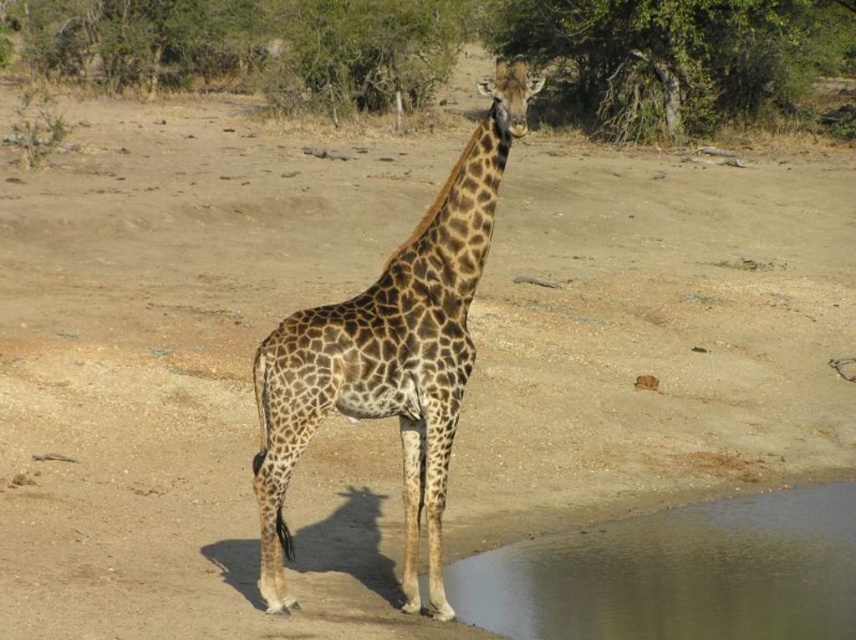
Question: Which of the following is the farthest from the observer?

Choices:
 (A) spotted fur giraffe at center
 (B) transparent water at lower right

Answer: (B)

Question: Is spotted fur giraffe at center wider than transparent water at lower right?

Choices:
 (A) yes
 (B) no

Answer: (A)

Question: Is spotted fur giraffe at center bigger than transparent water at lower right?

Choices:
 (A) yes
 (B) no

Answer: (A)

Question: Which point appears farthest from the camera in this image?

Choices:
 (A) (462, 390)
 (B) (800, 497)

Answer: (B)

Question: Can you confirm if spotted fur giraffe at center is thinner than transparent water at lower right?

Choices:
 (A) no
 (B) yes

Answer: (A)